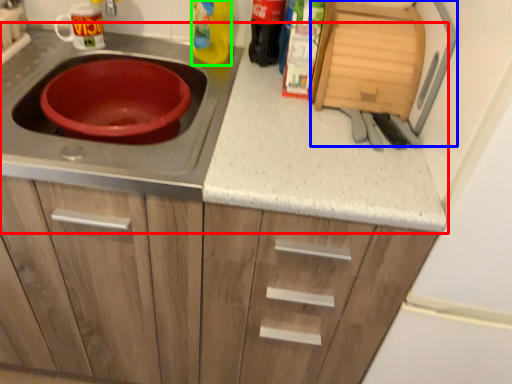
Question: Based on their relative distances, which object is farther from countertop (highlighted by a red box)? Choose from appliance (highlighted by a blue box) and bottle (highlighted by a green box).

Choices:
 (A) appliance
 (B) bottle

Answer: (B)